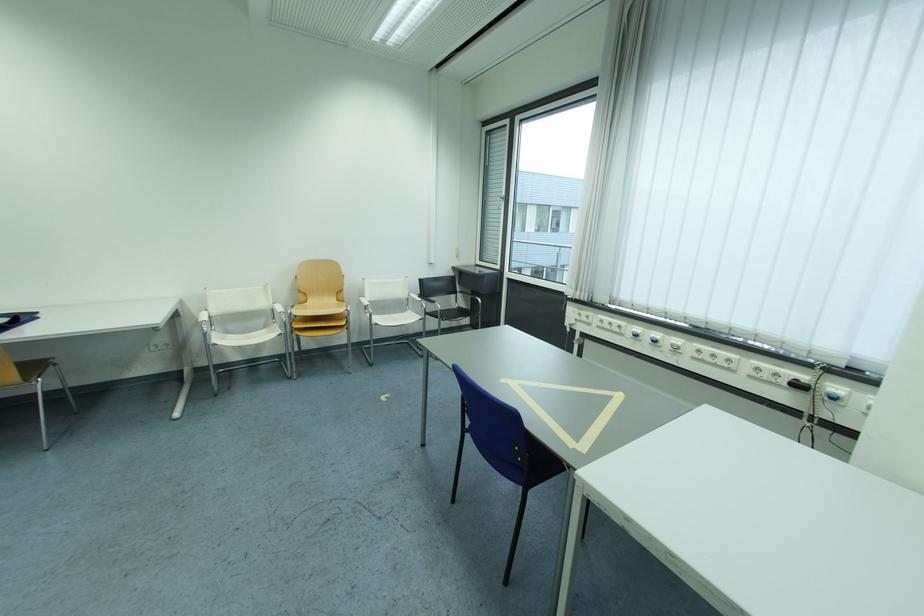
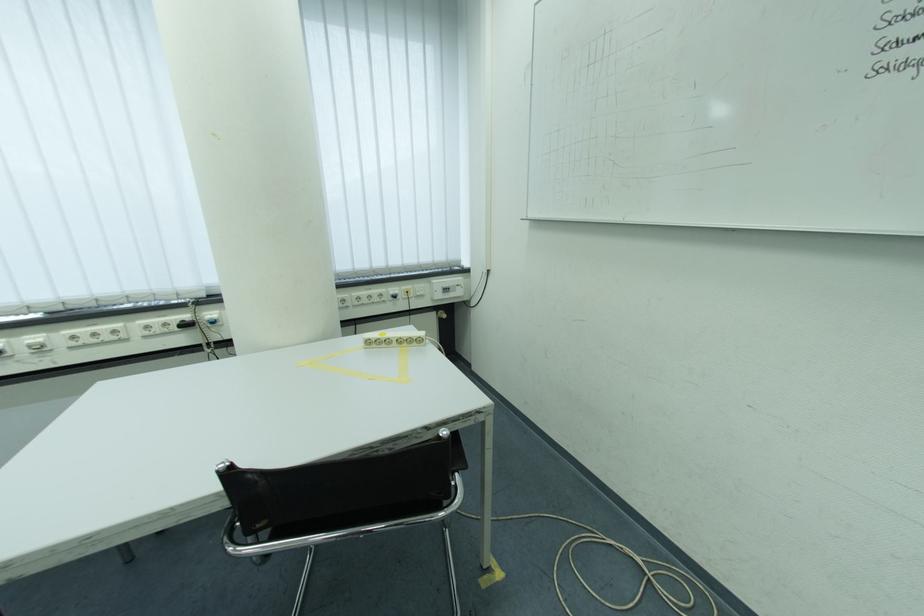
In the second image, find the point that corresponds to (x=708, y=354) in the first image.

(82, 339)